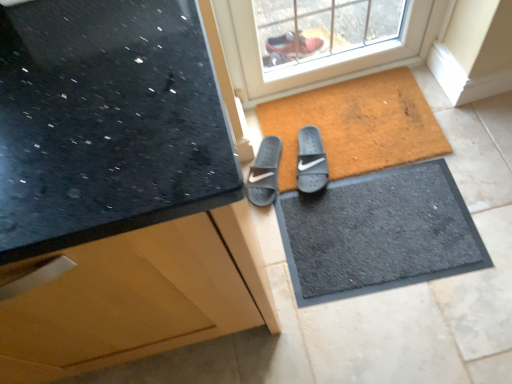
The height and width of the screenshot is (384, 512). Identify the location of empty space that is ontop of gray rubber slide at center, the 2th footwear positioned from the right (from a real-world perspective). (259, 162).